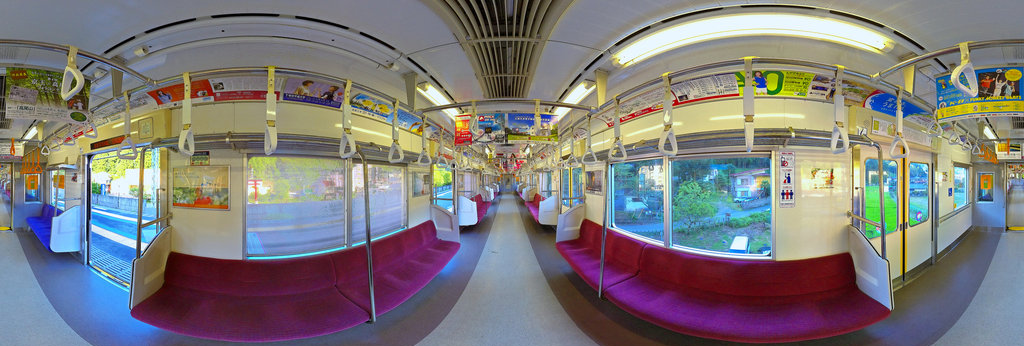
This screenshot has height=346, width=1024. Identify the location of bench seat. (293, 310).